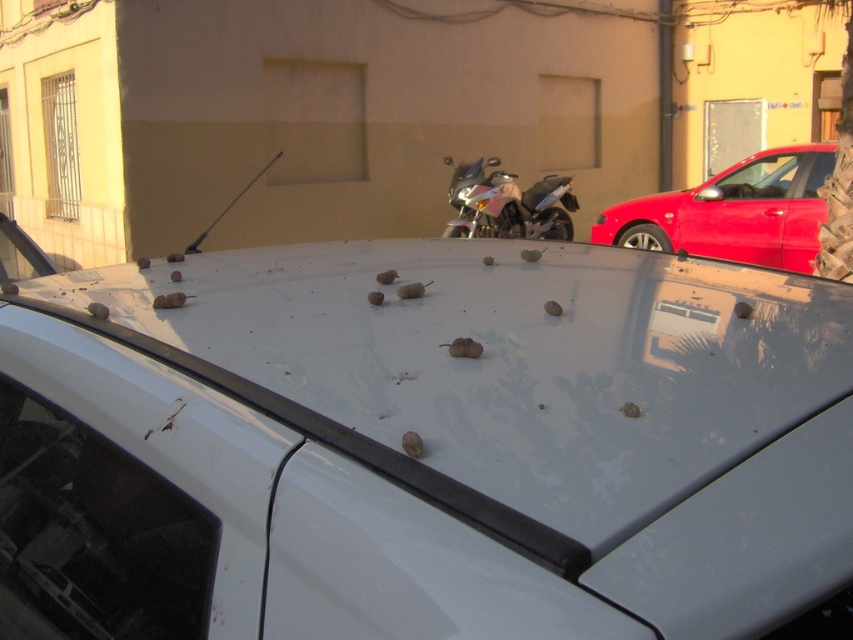
Question: Where is transparent glass windshield at lower left located in relation to shiny red car at upper right in the image?

Choices:
 (A) right
 (B) left

Answer: (B)

Question: Considering the real-world distances, which object is closest to the shiny red car at upper right?

Choices:
 (A) white glossy car at center
 (B) shiny metallic motorcycle at center

Answer: (B)

Question: Can you confirm if white glossy car at center is bigger than transparent glass windshield at lower left?

Choices:
 (A) no
 (B) yes

Answer: (B)

Question: Is shiny red car at upper right positioned behind shiny metallic motorcycle at center?

Choices:
 (A) yes
 (B) no

Answer: (B)

Question: Which point appears closest to the camera in this image?

Choices:
 (A) (688, 602)
 (B) (515, 205)
 (C) (821, 141)
 (D) (13, 474)

Answer: (A)

Question: Which of the following is the farthest from the observer?

Choices:
 (A) shiny metallic motorcycle at center
 (B) shiny red car at upper right

Answer: (A)